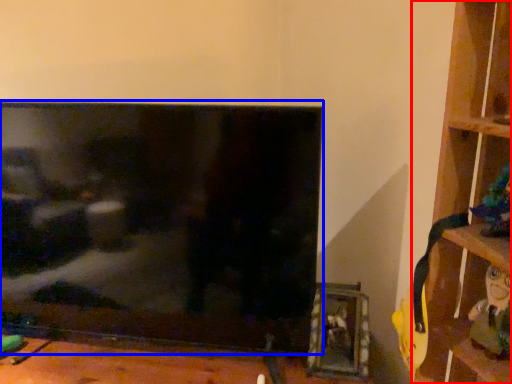
Question: Which point is closer to the camera, shelf (highlighted by a red box) or television (highlighted by a blue box)?

Choices:
 (A) shelf
 (B) television

Answer: (A)